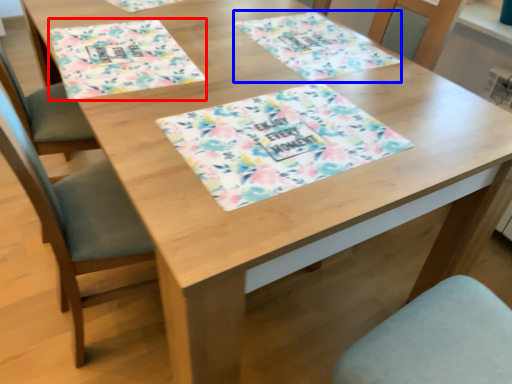
Question: Which of the following is the closest to the observer, place mat (highlighted by a red box) or place mat (highlighted by a blue box)?

Choices:
 (A) place mat
 (B) place mat

Answer: (A)